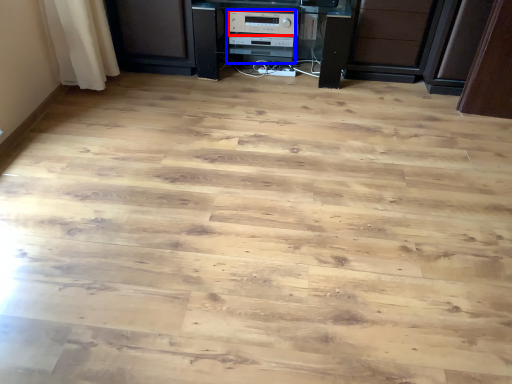
Question: Which of the following is the farthest to the observer, appliance (highlighted by a red box) or appliance (highlighted by a blue box)?

Choices:
 (A) appliance
 (B) appliance

Answer: (B)